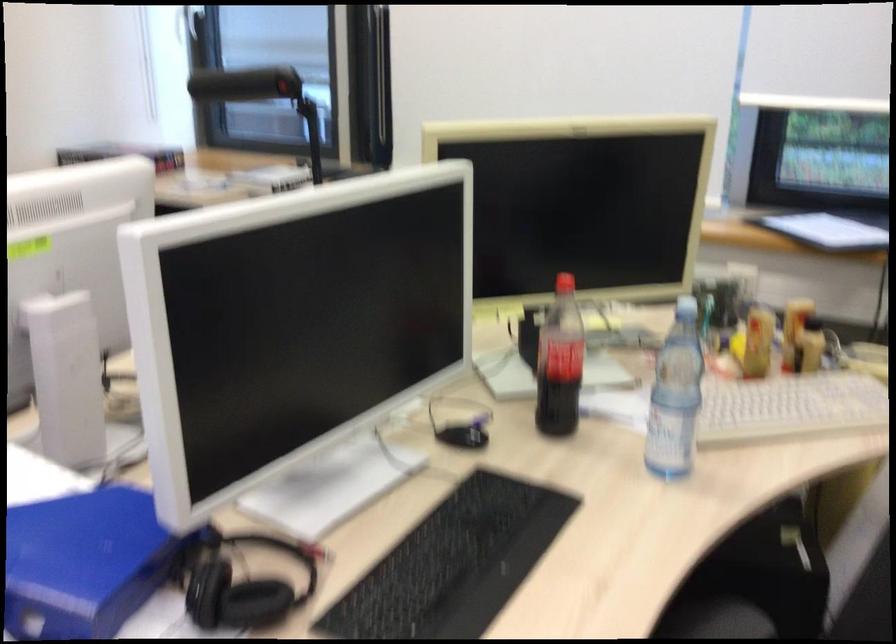
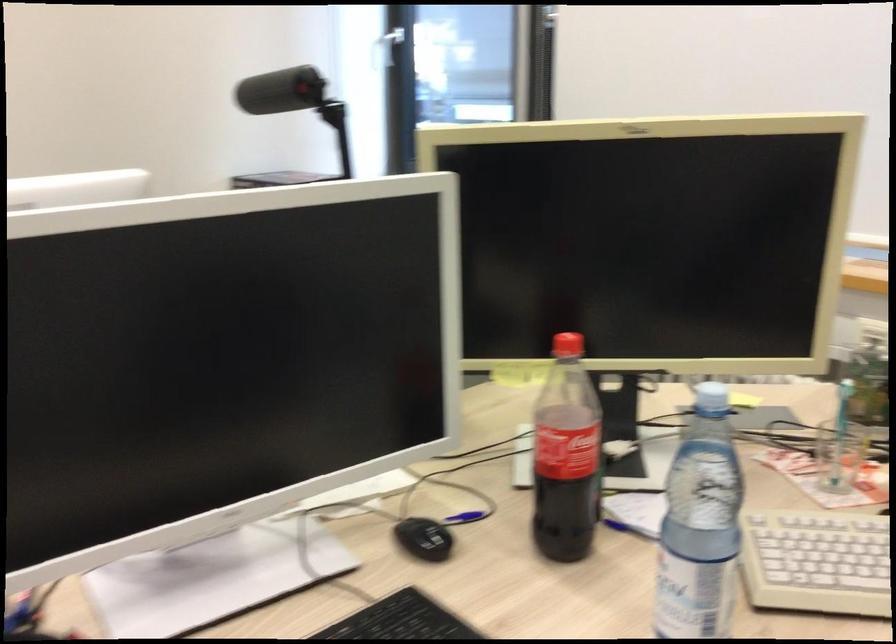
In a continuous first-person perspective shot, in which direction is the camera moving?

The cameraman walked toward right, forward.